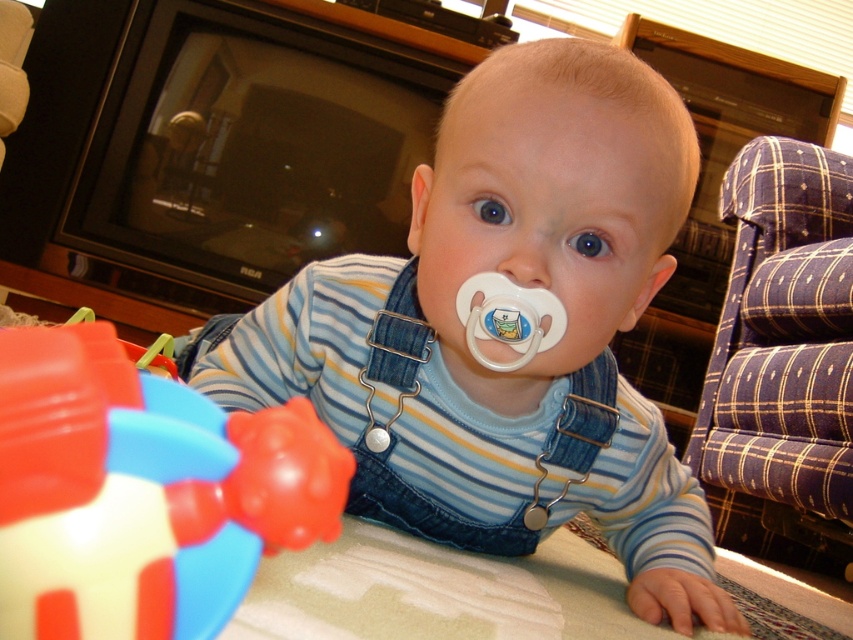
Question: Which of the following is the farthest from the observer?

Choices:
 (A) matte plastic pacifier at center
 (B) blue plaid fabric armchair at right

Answer: (B)

Question: Considering the relative positions of matte plastic pacifier at center and rubberized plastic cube at lower left in the image provided, where is matte plastic pacifier at center located with respect to rubberized plastic cube at lower left?

Choices:
 (A) above
 (B) below

Answer: (A)

Question: Among these points, which one is farthest from the camera?

Choices:
 (A) (218, 468)
 (B) (502, 492)
 (C) (824, 326)

Answer: (C)

Question: In this image, where is matte plastic pacifier at center located relative to rubberized plastic cube at lower left?

Choices:
 (A) right
 (B) left

Answer: (A)

Question: Which is farther from the rubberized plastic cube at lower left?

Choices:
 (A) matte plastic pacifier at center
 (B) blue plaid fabric armchair at right

Answer: (B)

Question: Is matte plastic pacifier at center closer to the viewer compared to rubberized plastic cube at lower left?

Choices:
 (A) no
 (B) yes

Answer: (A)